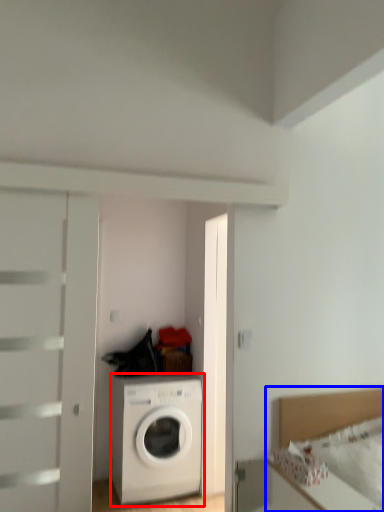
Question: Which object is further to the camera taking this photo, washing machine (highlighted by a red box) or bed (highlighted by a blue box)?

Choices:
 (A) washing machine
 (B) bed

Answer: (A)